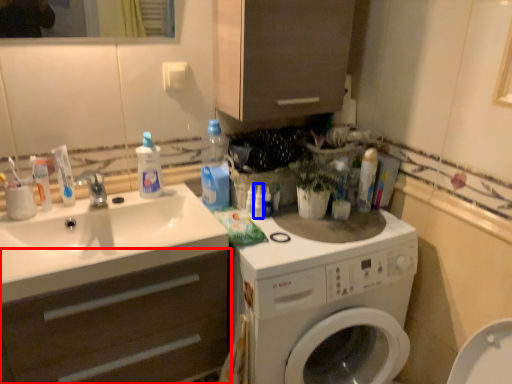
Question: Which object is closer to the camera taking this photo, bathroom cabinet (highlighted by a red box) or cleaning product (highlighted by a blue box)?

Choices:
 (A) bathroom cabinet
 (B) cleaning product

Answer: (A)